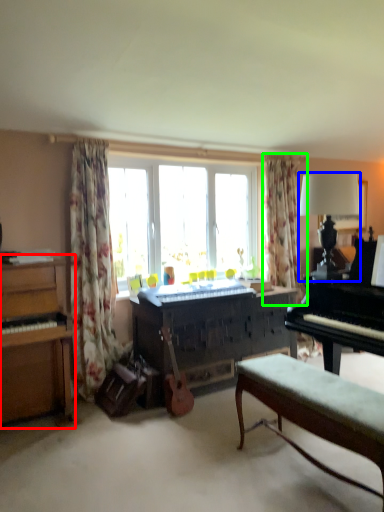
Question: Considering the real-world distances, which object is farthest from piano (highlighted by a red box)? lamp (highlighted by a blue box) or curtain (highlighted by a green box)?

Choices:
 (A) lamp
 (B) curtain

Answer: (B)